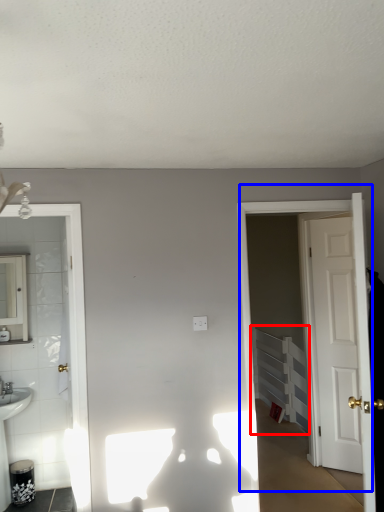
Question: Which object is closer to the camera taking this photo, radiator (highlighted by a red box) or door (highlighted by a blue box)?

Choices:
 (A) radiator
 (B) door

Answer: (B)